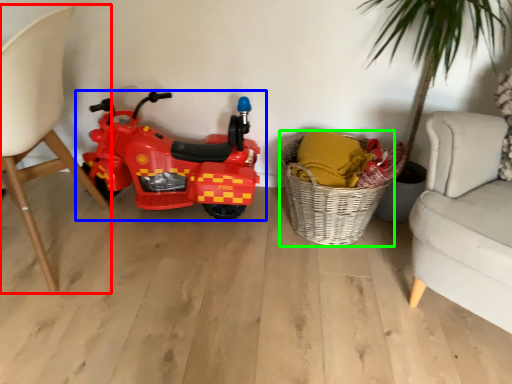
Question: Based on their relative distances, which object is nearer to chair (highlighted by a red box)? Choose from land vehicle (highlighted by a blue box) and basket (highlighted by a green box).

Choices:
 (A) land vehicle
 (B) basket

Answer: (A)